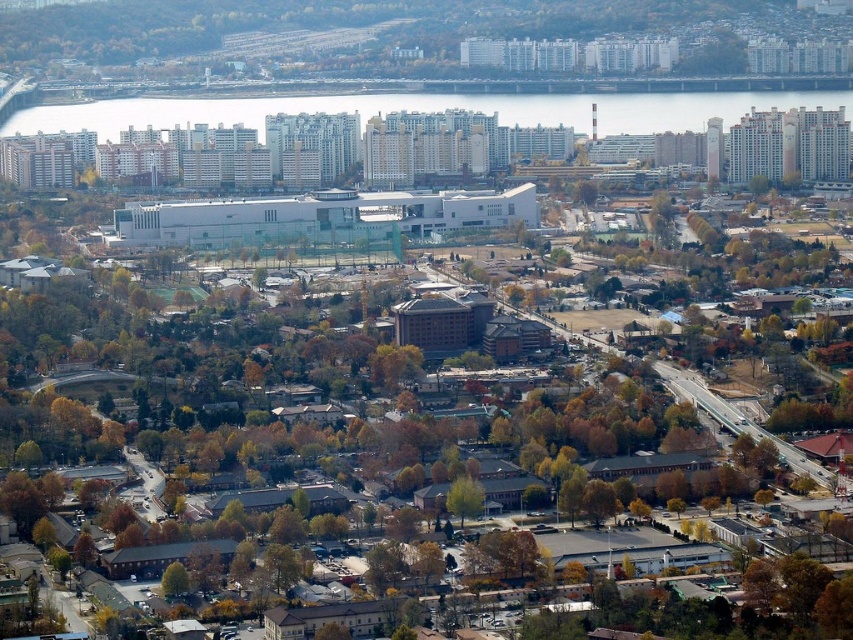
Who is positioned more to the left, clear water at center or green leafy tree at lower left?

From the viewer's perspective, green leafy tree at lower left appears more on the left side.

Locate an element on the screen. The image size is (853, 640). clear water at center is located at coordinates (426, 109).

Between green leafy tree at center and green leafy tree at lower left, which one appears on the left side from the viewer's perspective?

green leafy tree at lower left

Which is above, green leafy tree at center or green leafy tree at lower left?

green leafy tree at center

Does point (468, 493) come in front of point (173, 595)?

Yes.

The height and width of the screenshot is (640, 853). In order to click on green leafy tree at center in this screenshot , I will do `click(463, 497)`.

Is point (775, 93) positioned before point (463, 500)?

No.

Between clear water at center and green leafy tree at center, which one is positioned higher?

Positioned higher is clear water at center.

Where is `clear water at center`? The height and width of the screenshot is (640, 853). clear water at center is located at coordinates (426, 109).